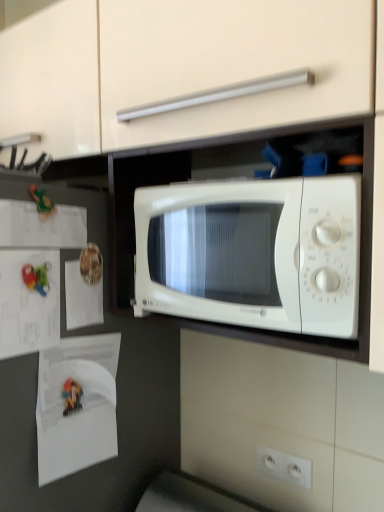
Question: Is there a large distance between white plastic electric outlet at lower center and white paper at left, which is the 3th paper from top to bottom?

Choices:
 (A) yes
 (B) no

Answer: (B)

Question: From the image's perspective, is white plastic electric outlet at lower center on white paper at left, which is the 3th paper from top to bottom?

Choices:
 (A) no
 (B) yes

Answer: (A)

Question: Can you confirm if white plastic electric outlet at lower center is taller than white paper at left, which is the 3th paper from top to bottom?

Choices:
 (A) no
 (B) yes

Answer: (A)

Question: Can you confirm if white plastic electric outlet at lower center is thinner than white paper at left, marked as the second paper in a bottom-to-top arrangement?

Choices:
 (A) no
 (B) yes

Answer: (A)

Question: From the image's perspective, does white plastic electric outlet at lower center appear lower than white paper at left, marked as the second paper in a bottom-to-top arrangement?

Choices:
 (A) no
 (B) yes

Answer: (B)

Question: Is white plastic electric outlet at lower center positioned behind white paper at left, which is the 3th paper from top to bottom?

Choices:
 (A) no
 (B) yes

Answer: (B)

Question: From the image's perspective, is white paper at left, marked as the 1th paper in a top-to-bottom arrangement, on top of green rubber toy at left?

Choices:
 (A) yes
 (B) no

Answer: (B)

Question: Is white paper at left, marked as the 4th paper in a bottom-to-top arrangement, oriented away from green rubber toy at left?

Choices:
 (A) no
 (B) yes

Answer: (A)

Question: Is white paper at left, marked as the 4th paper in a bottom-to-top arrangement, surrounding green rubber toy at left?

Choices:
 (A) yes
 (B) no

Answer: (A)

Question: Does white paper at left, marked as the 4th paper in a bottom-to-top arrangement, have a greater height compared to green rubber toy at left?

Choices:
 (A) no
 (B) yes

Answer: (B)

Question: Can you confirm if white paper at left, marked as the 4th paper in a bottom-to-top arrangement, is positioned to the left of green rubber toy at left?

Choices:
 (A) yes
 (B) no

Answer: (B)

Question: From a real-world perspective, does white paper at left, marked as the 4th paper in a bottom-to-top arrangement, sit lower than green rubber toy at left?

Choices:
 (A) no
 (B) yes

Answer: (B)

Question: Considering the relative sizes of white paper at left, arranged as the third paper when ordered from the bottom, and white plastic electric outlet at lower center in the image provided, is white paper at left, arranged as the third paper when ordered from the bottom, bigger than white plastic electric outlet at lower center?

Choices:
 (A) yes
 (B) no

Answer: (A)